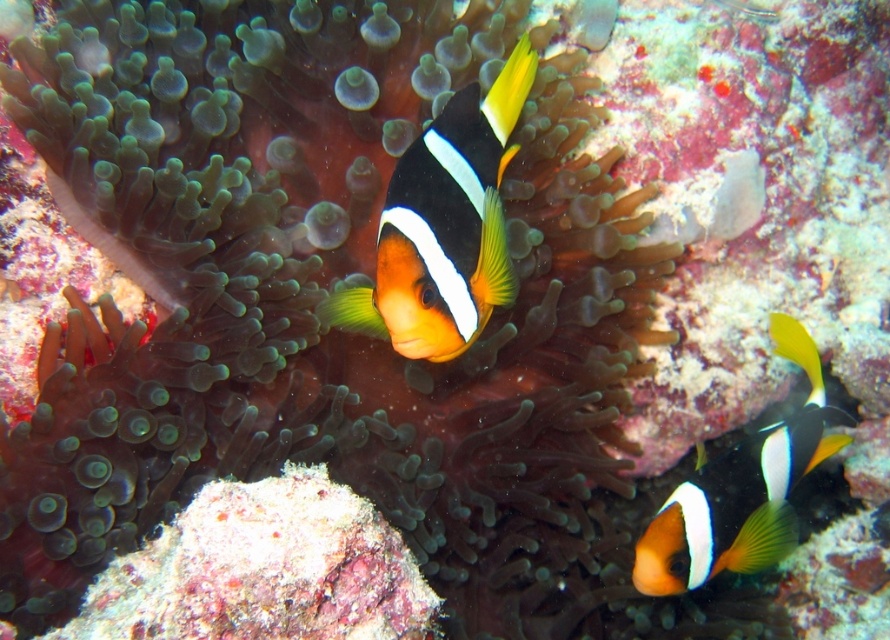
You are a scuba diver looking at two points in an underwater scene. The first point is at coordinates point (x=354, y=301) and the second is at point (x=843, y=417). Which point is closer to you?

Point (x=354, y=301) is closer to the viewer than point (x=843, y=417).

You are a marine biologist observing the underwater scene. You notice two clownfish. The first is an orange matte clownfish at center, and the second is an orange and white clownfish at lower right. Which clownfish is located above the other?

The orange matte clownfish at center is positioned over the orange and white clownfish at lower right, meaning it is above the other.